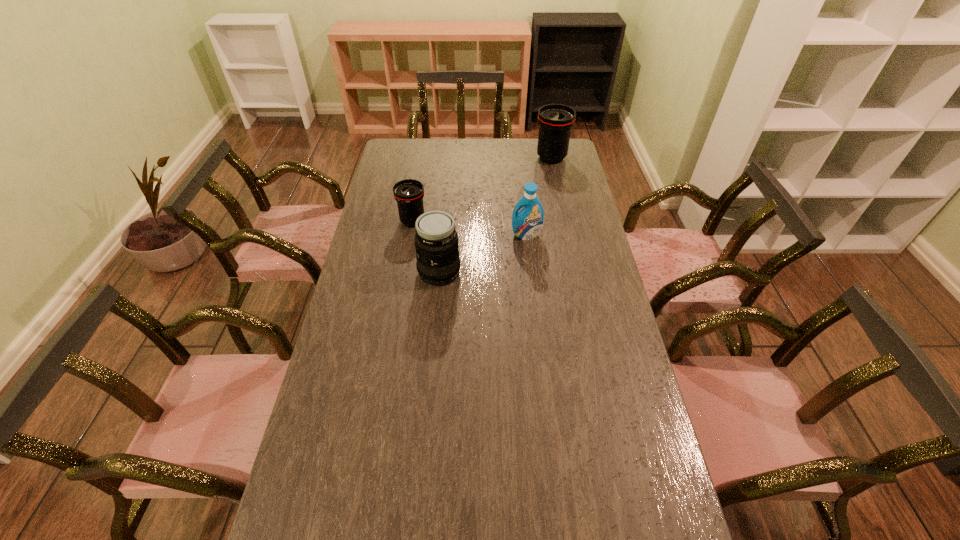
Identify the location of object at the far edge. Image resolution: width=960 pixels, height=540 pixels. (555, 121).

The width and height of the screenshot is (960, 540). Identify the location of object present at the left edge. (409, 193).

What are the coordinates of `object located in the right edge section of the desktop` in the screenshot? It's located at (555, 121).

Find the location of a particular element. The height and width of the screenshot is (540, 960). object located at the far right corner is located at coordinates (555, 121).

Image resolution: width=960 pixels, height=540 pixels. In order to click on free space at the far edge of the desktop in this screenshot , I will do `click(429, 159)`.

In the image, there is a desktop. Where is `vacant space at the left edge`? This screenshot has width=960, height=540. vacant space at the left edge is located at coordinates (406, 231).

The image size is (960, 540). In order to click on vacant space at the right edge of the desktop in this screenshot , I will do `click(581, 354)`.

Where is `free space that is in between the second object from right to left and the rightmost telephoto lens`? free space that is in between the second object from right to left and the rightmost telephoto lens is located at coordinates (539, 197).

Image resolution: width=960 pixels, height=540 pixels. Identify the location of vacant space that's between the farthest object and the shortest object. (482, 190).

The height and width of the screenshot is (540, 960). I want to click on vacant area that lies between the rightmost object and the nearest object, so click(495, 215).